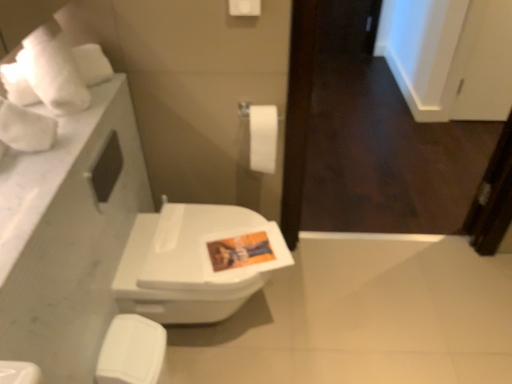
Question: Is white matte toilet paper at center placed right next to white glossy toilet seat at lower left?

Choices:
 (A) yes
 (B) no

Answer: (B)

Question: Can you confirm if white matte toilet paper at center is positioned to the left of white glossy toilet seat at lower left?

Choices:
 (A) yes
 (B) no

Answer: (B)

Question: Can you confirm if white matte toilet paper at center is taller than white glossy toilet seat at lower left?

Choices:
 (A) no
 (B) yes

Answer: (A)

Question: From the image's perspective, is white matte toilet paper at center under white glossy toilet seat at lower left?

Choices:
 (A) yes
 (B) no

Answer: (B)

Question: Is white matte toilet paper at center wider than white glossy toilet seat at lower left?

Choices:
 (A) no
 (B) yes

Answer: (A)

Question: From the image's perspective, is white matte toilet paper at center over white glossy toilet seat at lower left?

Choices:
 (A) yes
 (B) no

Answer: (A)

Question: Are white glossy toilet at center and white matte toilet paper at center far apart?

Choices:
 (A) no
 (B) yes

Answer: (A)

Question: Is white glossy toilet at center turned away from white matte toilet paper at center?

Choices:
 (A) yes
 (B) no

Answer: (B)

Question: Is white glossy toilet at center completely or partially outside of white matte toilet paper at center?

Choices:
 (A) no
 (B) yes

Answer: (B)

Question: Is white matte toilet paper at center a part of white glossy toilet at center?

Choices:
 (A) no
 (B) yes

Answer: (A)

Question: Can you confirm if white glossy toilet at center is smaller than white matte toilet paper at center?

Choices:
 (A) no
 (B) yes

Answer: (A)

Question: From the image's perspective, would you say white glossy toilet at center is positioned over white matte toilet paper at center?

Choices:
 (A) no
 (B) yes

Answer: (A)

Question: Is white glossy toilet seat at lower left next to white matte toilet paper at center and touching it?

Choices:
 (A) no
 (B) yes

Answer: (A)